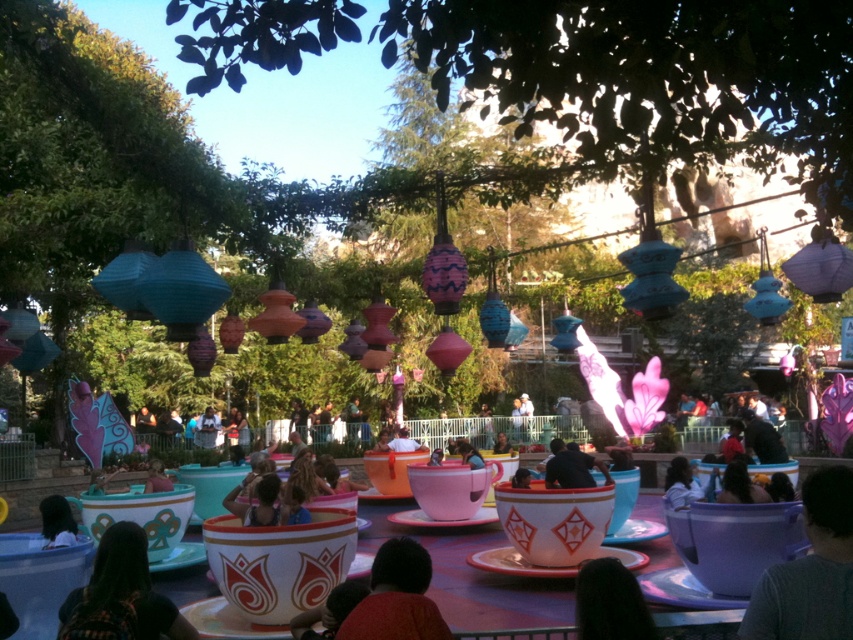
You are standing at the entrance of the Mad Hatter Tea Party ride and see the plaid shirt at lower left and the pink fabric person at center. If you want to wave to both of them, which one should you aim your wave towards first, the one closer to you or the one farther away?

The plaid shirt at lower left is 6.42 meters away from the pink fabric person at center. Since you want to wave to both, you should aim your wave towards the closer one first. However, the description only provides the distance between them, not their individual distances from you. Without knowing their exact positions relative to your location, it is impossible to determine which is closer to you.

You are a photographer standing at the edge of the ride area. You want to take a photo of both the dark brown hair at center and the matte blue shirt at center in the same frame. The camera you are using has a maximum focus range of 25 inches. Will both subjects be in focus?

The distance between dark brown hair at center and matte blue shirt at center is 26.05 inches, which exceeds the camera maximum focus range of 25 inches. Therefore, both subjects cannot be in focus at the same time.

You are a ride operator and need to ensure that all passengers are within the safety limits. The plaid shirt at lower left and the matte red shirt at center are both in the same boat. According to the safety guidelines, no passenger should be wider than 40 cm. Can you determine if either of these passengers exceeds the width limit?

The plaid shirt at lower left might be wider than matte red shirt at center. However, without specific measurements, it is impossible to confirm if either exceeds the 40 cm limit. Further inspection is required.